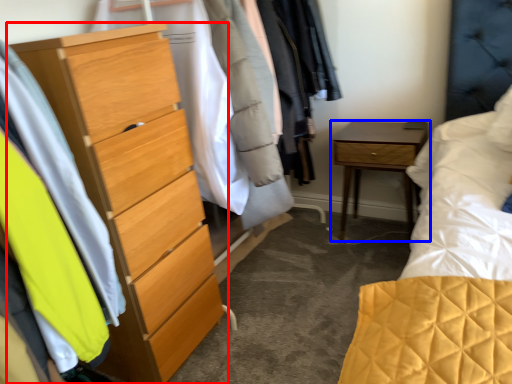
Question: Which object is closer to the camera taking this photo, chest of drawers (highlighted by a red box) or nightstand (highlighted by a blue box)?

Choices:
 (A) chest of drawers
 (B) nightstand

Answer: (A)